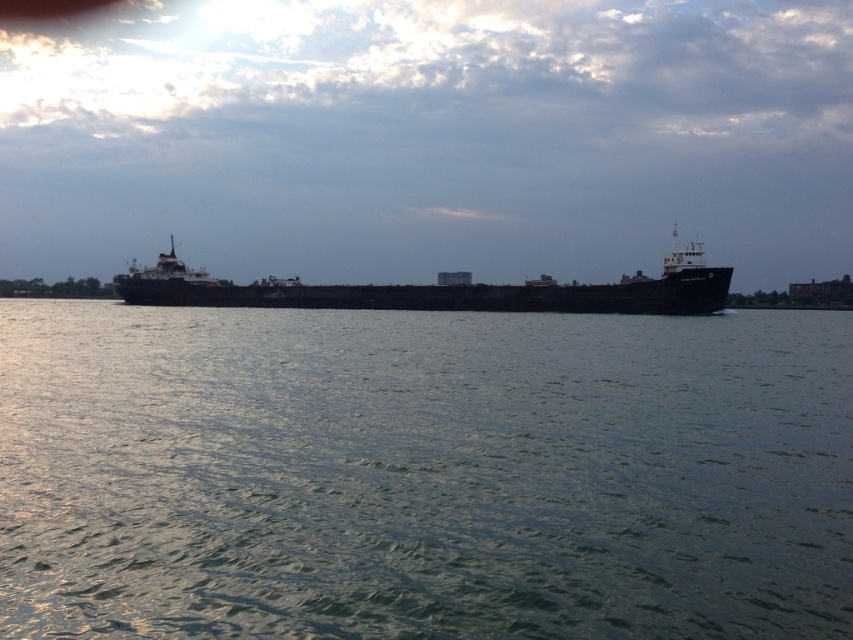
Question: Does green water at center have a lesser width compared to black matte ship at center?

Choices:
 (A) no
 (B) yes

Answer: (B)

Question: Is green water at center to the right of black matte ship at center from the viewer's perspective?

Choices:
 (A) no
 (B) yes

Answer: (A)

Question: Can you confirm if green water at center is positioned below black matte ship at center?

Choices:
 (A) yes
 (B) no

Answer: (A)